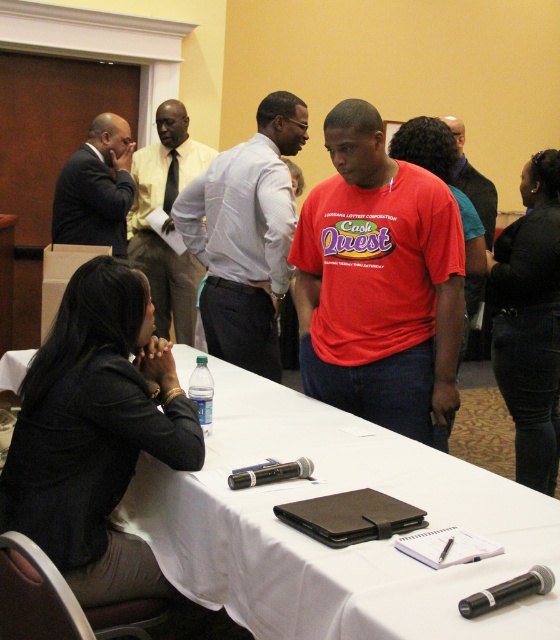
Question: Which object is farther from the camera taking this photo?

Choices:
 (A) yellow shirt at center
 (B) black leather jacket at lower right
 (C) black fabric jacket at lower left

Answer: (A)

Question: Which point is closer to the camera?

Choices:
 (A) (88, 240)
 (B) (534, 246)
 (C) (74, 417)

Answer: (C)

Question: Is matte red t-shirt at center below black leather jacket at lower right?

Choices:
 (A) yes
 (B) no

Answer: (B)

Question: Which point is farther to the camera?

Choices:
 (A) (557, 172)
 (B) (11, 476)

Answer: (A)

Question: Is yellow shirt at center in front of red matte shirt at center?

Choices:
 (A) yes
 (B) no

Answer: (B)

Question: Is matte red t-shirt at center above dark suit at left?

Choices:
 (A) no
 (B) yes

Answer: (A)